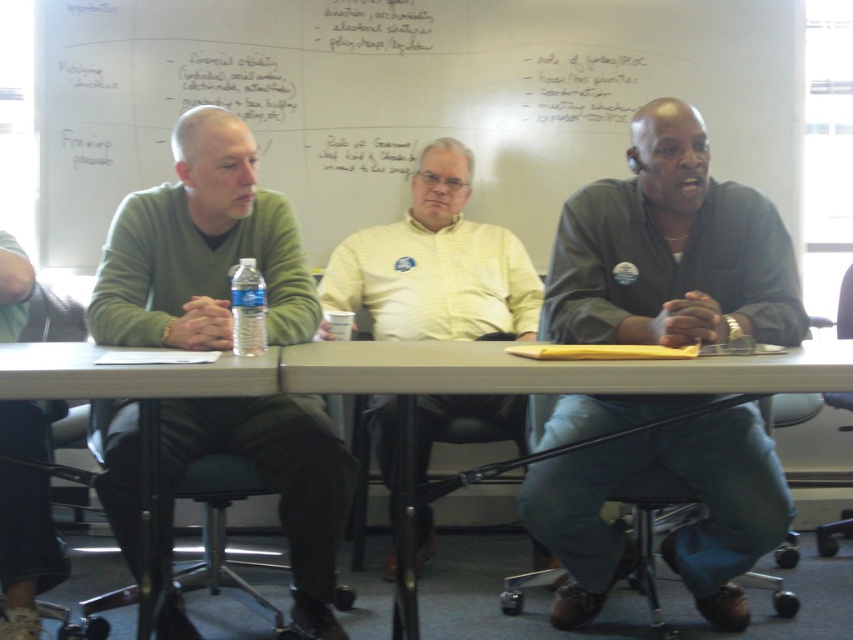
Question: Observing the image, what is the correct spatial positioning of whiteboard at upper center in reference to green sweater at left?

Choices:
 (A) left
 (B) right

Answer: (B)

Question: Among these objects, which one is nearest to the camera?

Choices:
 (A) yellow shirt at center
 (B) dark gray shirt at center

Answer: (B)

Question: Which of the following is the farthest from the observer?

Choices:
 (A) (317, 16)
 (B) (405, 348)
 (C) (494, 262)

Answer: (A)

Question: Can you confirm if whiteboard at upper center is smaller than yellow shirt at center?

Choices:
 (A) no
 (B) yes

Answer: (A)

Question: Which object appears farthest from the camera in this image?

Choices:
 (A) clear plastic water bottle at center
 (B) smooth plastic table at center

Answer: (A)

Question: Can you confirm if smooth plastic table at center is positioned below clear plastic water bottle at center?

Choices:
 (A) yes
 (B) no

Answer: (A)